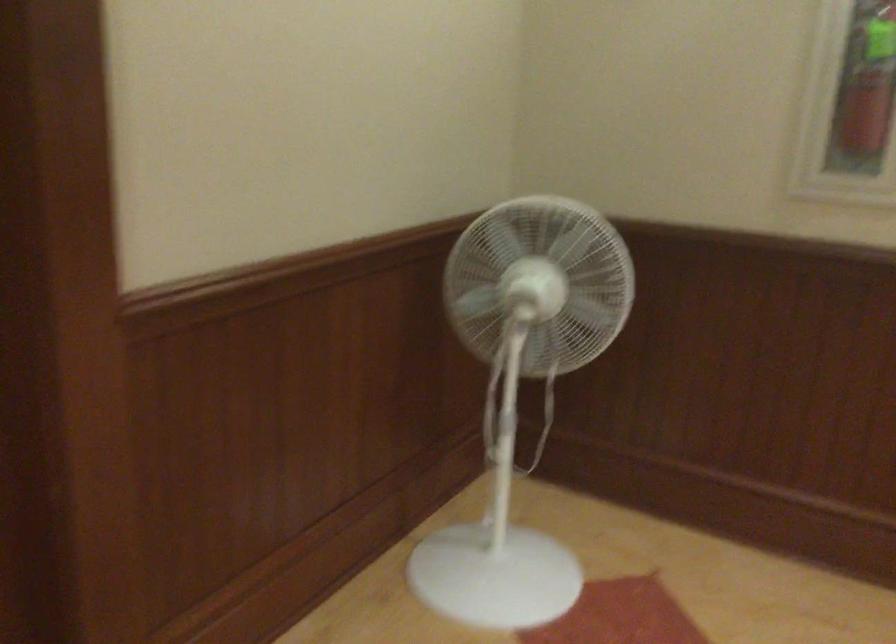
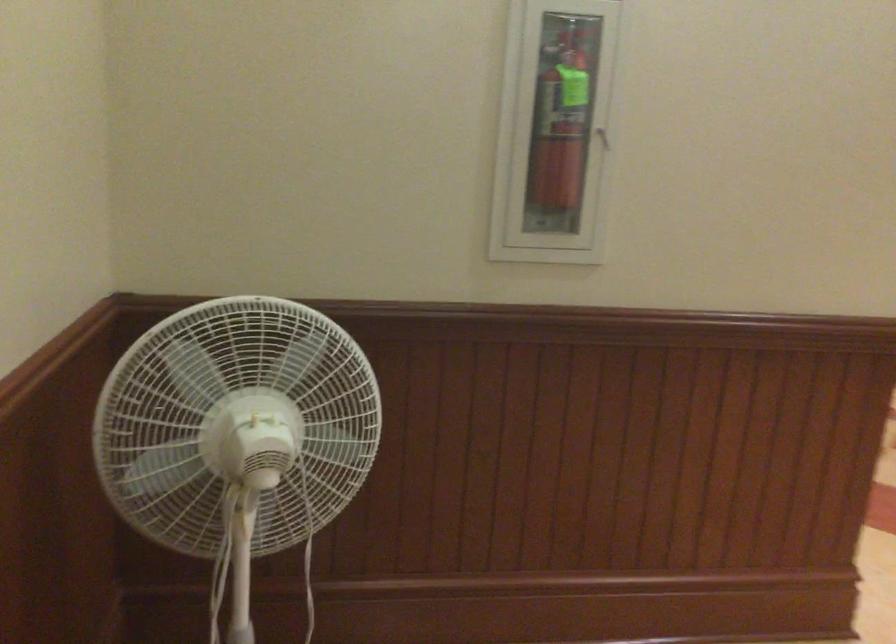
Question: The camera is either moving clockwise (left) or counter-clockwise (right) around the object. The first image is from the beginning of the video and the second image is from the end. Is the camera moving left or right when shooting the video?

Choices:
 (A) Left
 (B) Right

Answer: (A)